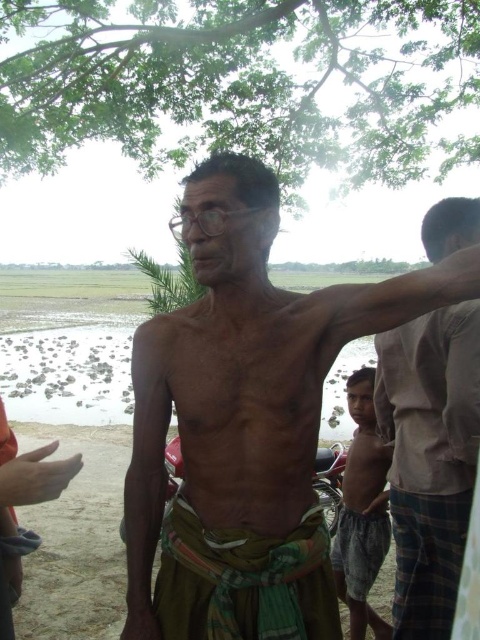
You are standing at the viewpoint of the image and want to reach the point marked as point (303, 436). Given that you can walk 3 feet in one step, how many steps would it take you to reach that point?

The distance between you and point (303, 436) is 4.36 feet. Since each step covers 3 feet, you would need approximately 2 steps to reach the point.